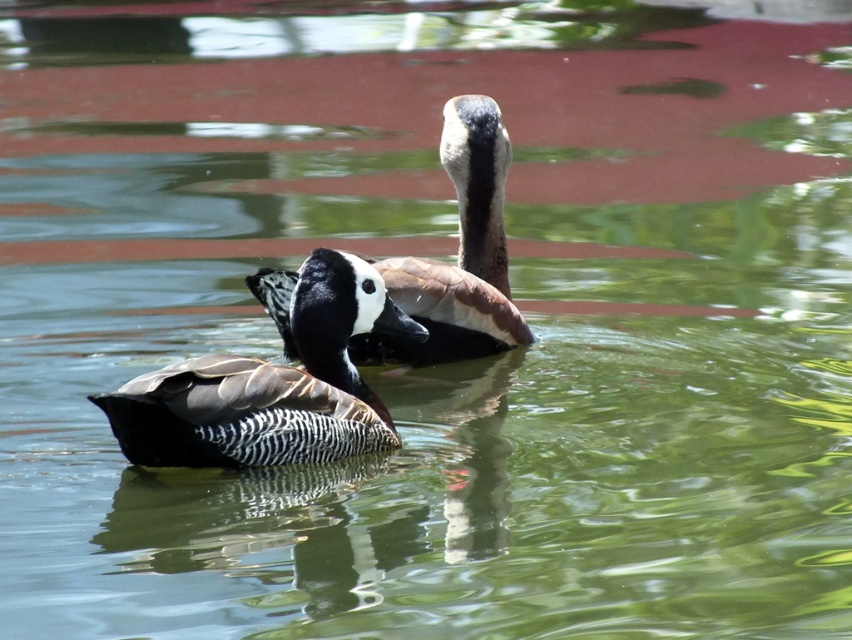
Does point (364, 291) come farther from viewer compared to point (386, 362)?

That is False.

Which is in front, point (400, 333) or point (508, 310)?

Point (400, 333)

At what (x,y) coordinates should I click in order to perform the action: click on speckled brown duck at center. Please return your answer as a coordinate pair (x, y). The height and width of the screenshot is (640, 852). Looking at the image, I should click on pos(269,385).